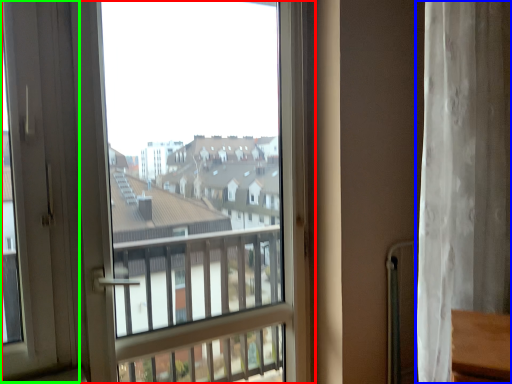
Question: Which object is the closest to the window (highlighted by a red box)? Choose among these: curtain (highlighted by a blue box) or screen door (highlighted by a green box).

Choices:
 (A) curtain
 (B) screen door

Answer: (B)